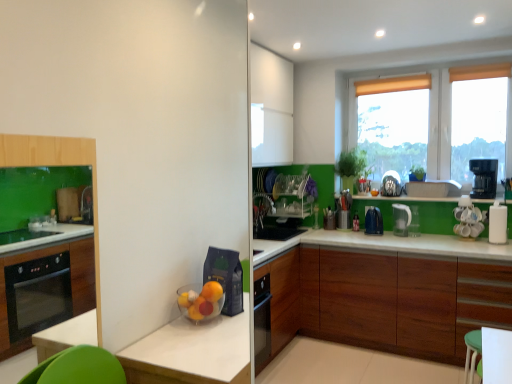
The width and height of the screenshot is (512, 384). Find the location of `vacant area that is in front of white glossy paper towel dispenser at right, the fourth appliance viewed from the back`. vacant area that is in front of white glossy paper towel dispenser at right, the fourth appliance viewed from the back is located at coordinates (501, 247).